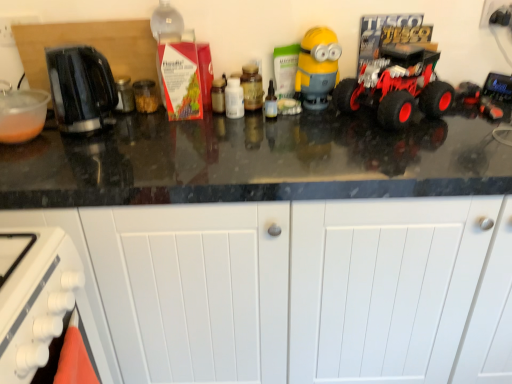
The height and width of the screenshot is (384, 512). In order to click on free space in front of rubberized red truck at right in this screenshot , I will do `click(380, 147)`.